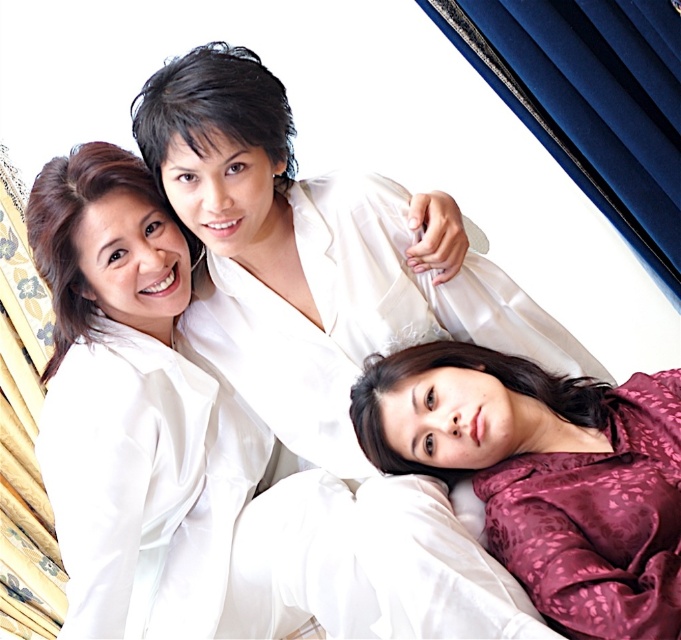
You are a photographer trying to capture the perfect shot of the scene. The camera is set up at the origin point. Where should you focus your camera to capture the white satin shirt at center?

The white satin shirt at center is located at the 2D coordinates of point (308,259), so you should focus your camera at that point to capture it.